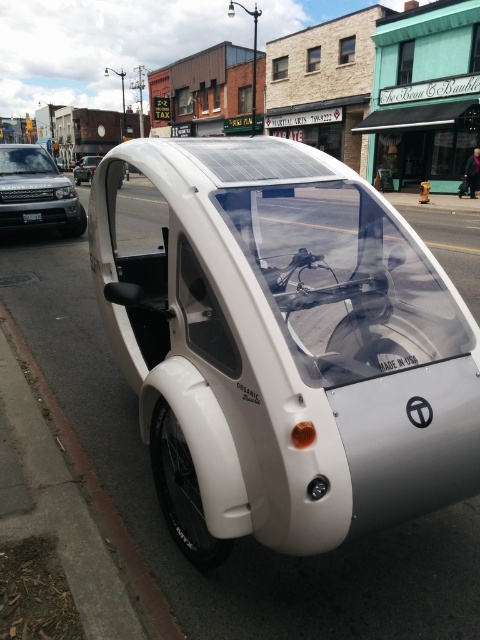
What is the color of the area where the point at coordinates (471,172) is located?

The point at coordinates (471,172) is located on the white matte coach at center, so the color is white.

Based on the scene description, where is the white matte coach at center located in the image?

The white matte coach at center is located at point coordinates of (471, 172).

In the scene shown: You are a city planner designing a new parking lot. You need to park both the white matte concept car at center and the white matte coach at center in a single row. Based on their positions in the image, which vehicle should be placed on the left side of the row to maintain the same spatial relationship?

The white matte concept car at center should be placed on the left side of the row since it is positioned to the left of the white matte coach at center in the image.